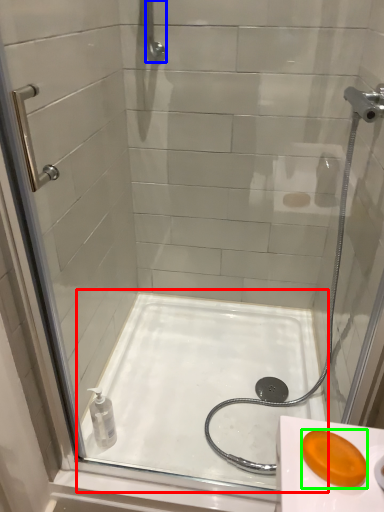
Question: Which is farther away from bath (highlighted by a red box)? shower (highlighted by a blue box) or soap (highlighted by a green box)?

Choices:
 (A) shower
 (B) soap

Answer: (A)